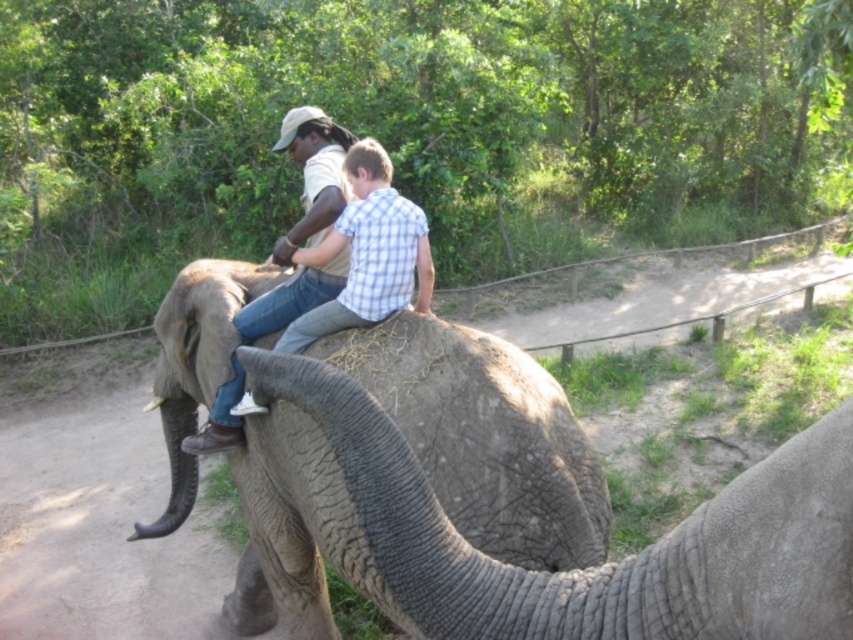
What do you see at coordinates (486, 436) in the screenshot? I see `gray textured elephant at center` at bounding box center [486, 436].

Which is more to the right, gray textured elephant at center or matte khaki shirt at center?

Positioned to the right is gray textured elephant at center.

Is point (570, 499) positioned after point (334, 257)?

No.

Locate an element on the screen. This screenshot has width=853, height=640. gray textured elephant at center is located at coordinates (486, 436).